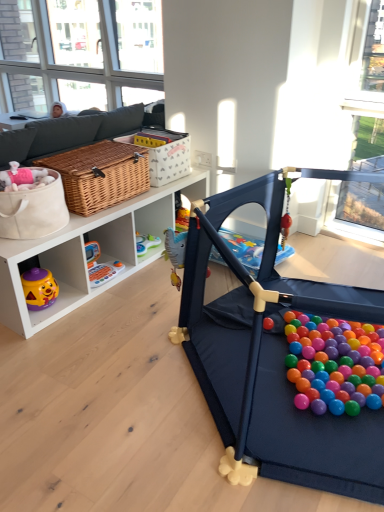
Question: Is woven brown picnic basket at center-left bigger than woven brown basket at upper center?

Choices:
 (A) yes
 (B) no

Answer: (A)

Question: Is woven brown picnic basket at center-left outside woven brown basket at upper center?

Choices:
 (A) yes
 (B) no

Answer: (A)

Question: Does woven brown picnic basket at center-left have a greater width compared to woven brown basket at upper center?

Choices:
 (A) no
 (B) yes

Answer: (B)

Question: Considering the relative positions of woven brown picnic basket at center-left and woven brown basket at upper center in the image provided, is woven brown picnic basket at center-left behind woven brown basket at upper center?

Choices:
 (A) yes
 (B) no

Answer: (B)

Question: From a real-world perspective, is woven brown picnic basket at center-left positioned under woven brown basket at upper center based on gravity?

Choices:
 (A) no
 (B) yes

Answer: (B)

Question: Is woven brown picnic basket at center-left in front of or behind rubberized plastic toy at lower left, marked as the 1th toy in a left-to-right arrangement, in the image?

Choices:
 (A) behind
 (B) front

Answer: (B)

Question: From the image's perspective, relative to rubberized plastic toy at lower left, placed as the second toy when sorted from front to back, is woven brown picnic basket at center-left above or below?

Choices:
 (A) below
 (B) above

Answer: (B)

Question: Does point (139, 188) appear closer or farther from the camera than point (117, 266)?

Choices:
 (A) closer
 (B) farther

Answer: (A)

Question: Is woven brown picnic basket at center-left taller or shorter than rubberized plastic toy at lower left, positioned as the 1th toy in back-to-front order?

Choices:
 (A) tall
 (B) short

Answer: (A)

Question: From a real-world perspective, relative to woven brown basket at upper center, is woven brown picnic basket at center-left vertically above or below?

Choices:
 (A) above
 (B) below

Answer: (B)

Question: Considering their positions, is woven brown picnic basket at center-left located in front of or behind woven brown basket at upper center?

Choices:
 (A) behind
 (B) front

Answer: (B)

Question: Considering the relative positions of woven brown picnic basket at center-left and woven brown basket at upper center in the image provided, is woven brown picnic basket at center-left to the left or to the right of woven brown basket at upper center?

Choices:
 (A) left
 (B) right

Answer: (A)

Question: In terms of size, does woven brown picnic basket at center-left appear bigger or smaller than woven brown basket at upper center?

Choices:
 (A) small
 (B) big

Answer: (B)

Question: From the image's perspective, is woven brown picnic basket at center-left located above or below clear glass window at upper left?

Choices:
 (A) above
 (B) below

Answer: (B)

Question: Is point (142, 180) positioned closer to the camera than point (102, 31)?

Choices:
 (A) closer
 (B) farther

Answer: (A)